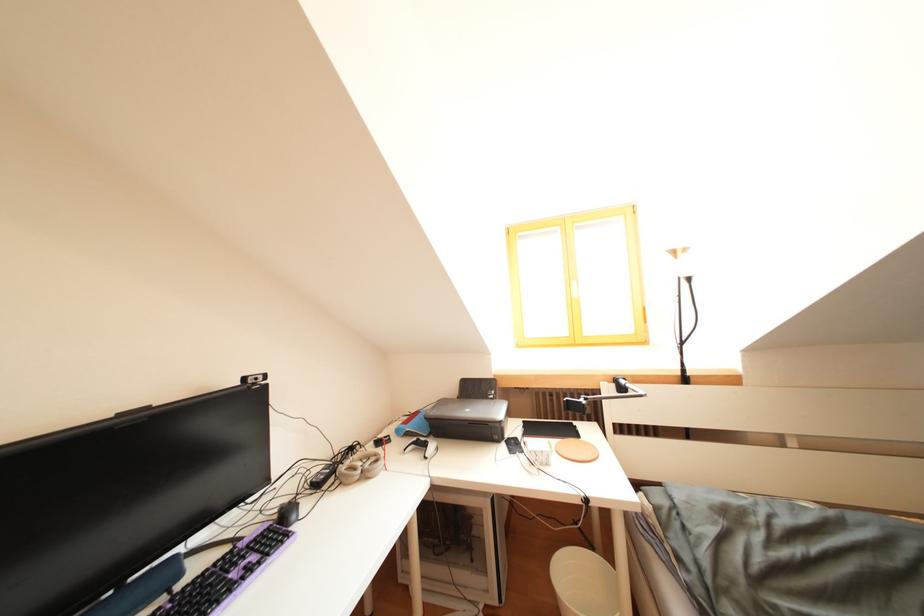
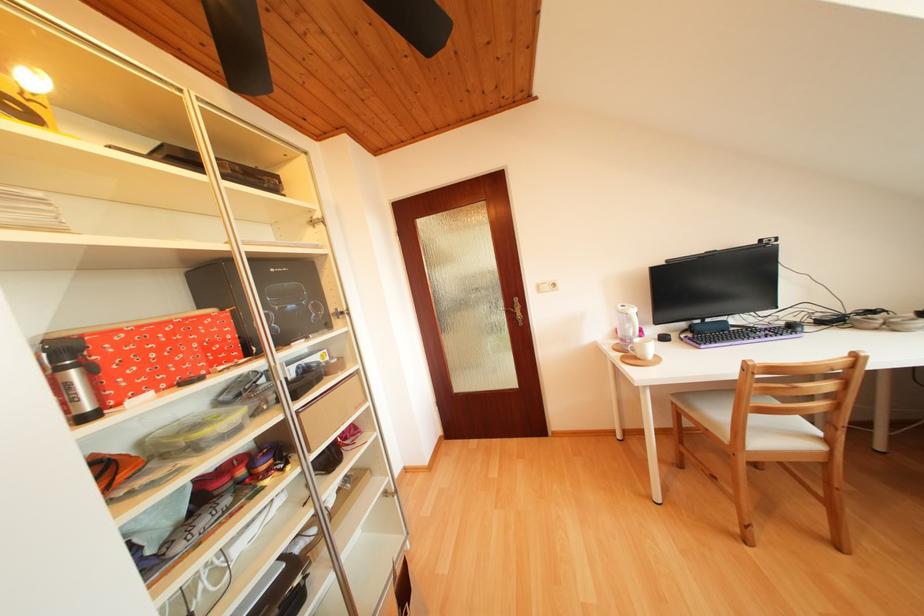
Find the pixel in the second image that matches (252,384) in the first image.

(769, 246)